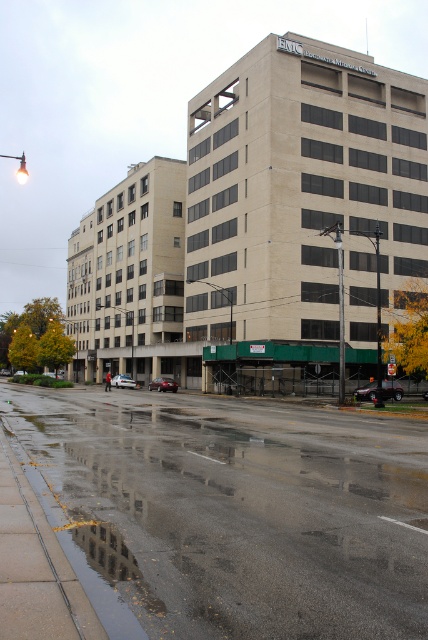
Is point (174, 390) in front of point (134, 380)?

Yes, point (174, 390) is closer to viewer.

Is point (160, 384) in front of point (122, 378)?

That is True.

This screenshot has height=640, width=428. In order to click on shiny red sedan at center in this screenshot , I will do `click(163, 385)`.

How far apart are shiny black sedan at center and shiny red sedan at center?

shiny black sedan at center is 25.26 meters from shiny red sedan at center.

Does shiny black sedan at center have a lesser height compared to shiny red sedan at center?

Incorrect, shiny black sedan at center's height does not fall short of shiny red sedan at center's.

Which is behind, point (369, 385) or point (154, 381)?

Point (154, 381)

At what (x,y) coordinates should I click in order to perform the action: click on shiny black sedan at center. Please return your answer as a coordinate pair (x, y). This screenshot has height=640, width=428. Looking at the image, I should click on (392, 388).

Is point (187, 609) farther from viewer compared to point (169, 380)?

No, (187, 609) is closer to viewer.

Who is more forward, (112,621) or (172,378)?

Point (112,621) is more forward.

The image size is (428, 640). I want to click on glossy asphalt road at lower center, so click(x=232, y=512).